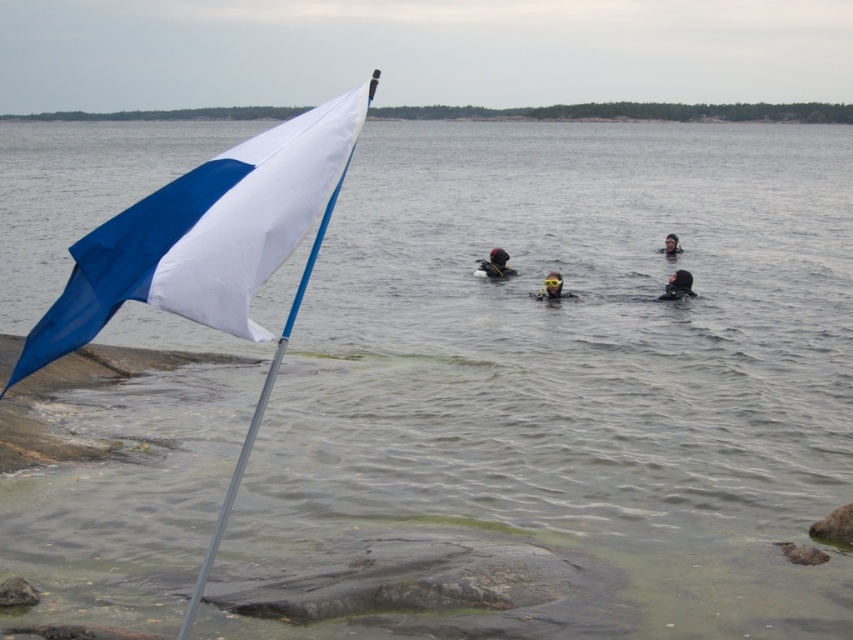
Looking at this image, you are a photographer trying to capture a clear shot of both the matte black wetsuit at center and the black rubber wetsuit at center. Since they are close together, you need to adjust your camera to focus on both. Which wetsuit should you focus on first to ensure both are in frame?

The matte black wetsuit at center is positioned on the left side of the black rubber wetsuit at center, so focusing on the matte black wetsuit at center first will help ensure both are in frame as they are aligned horizontally.

You are a safety officer overseeing the scuba diving activity. You notice the black rubber wetsuit at center and the yellow matte helmet at center. Which object is closer to the flagpole with the blue and white flag?

The black rubber wetsuit at center is closer to the flagpole with the blue and white flag because the yellow matte helmet at center is positioned behind it.